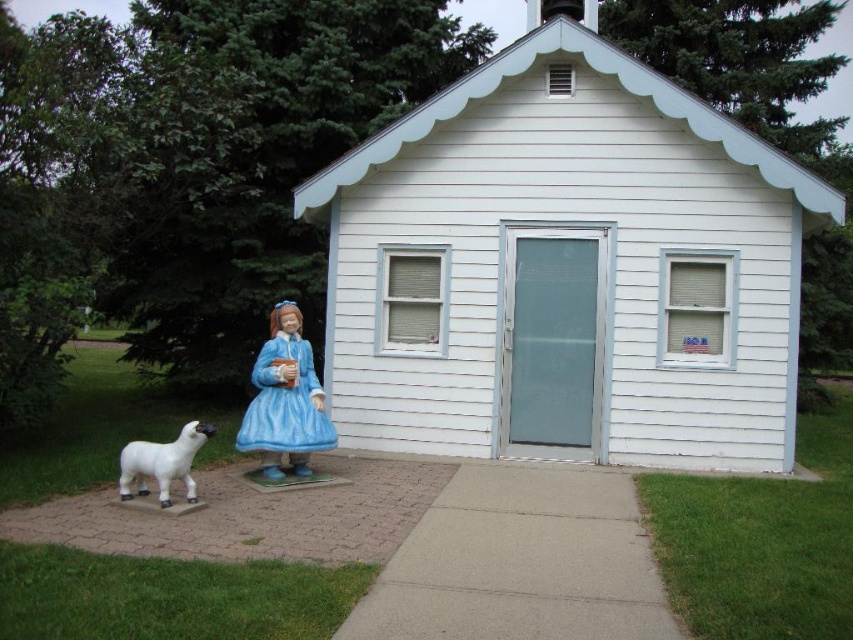
Does white painted wood chapel at center appear on the left side of blue glossy dress at center?

In fact, white painted wood chapel at center is to the right of blue glossy dress at center.

Based on the photo, is white painted wood chapel at center shorter than blue glossy dress at center?

No, white painted wood chapel at center is not shorter than blue glossy dress at center.

What do you see at coordinates (567, 268) in the screenshot? I see `white painted wood chapel at center` at bounding box center [567, 268].

Find the location of `white painted wood chapel at center`. white painted wood chapel at center is located at coordinates tap(567, 268).

Between point (289, 339) and point (212, 433), which one is positioned behind?

The point (289, 339) is behind.

The image size is (853, 640). I want to click on blue glossy dress at center, so click(285, 403).

From the picture: Can you confirm if white painted wood chapel at center is bigger than white glossy goat at left?

Indeed, white painted wood chapel at center has a larger size compared to white glossy goat at left.

Between white painted wood chapel at center and white glossy goat at left, which one appears on the right side from the viewer's perspective?

Positioned to the right is white painted wood chapel at center.

Consider the image. Measure the distance between point (540, 356) and camera.

The distance of point (540, 356) from camera is 8.32 meters.

You are a GUI agent. You are given a task and a screenshot of the screen. Output one action in this format:
    pyautogui.click(x=<x>, y=<y>)
    Task: Click on the white painted wood chapel at center
    This screenshot has width=853, height=640.
    Given the screenshot: What is the action you would take?
    pyautogui.click(x=567, y=268)